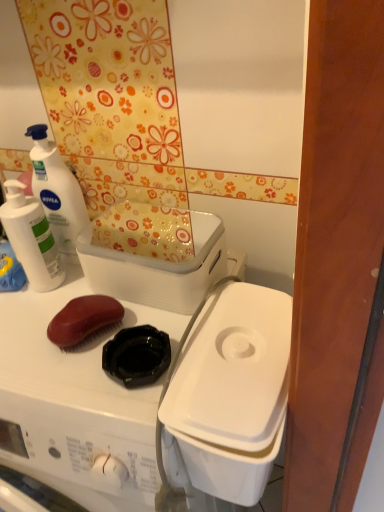
Question: From the image's perspective, would you say white plastic container at center-right, the 1th appliance when ordered from bottom to top, is shown under white matte lotion at upper left, which appears as the 1th cleaning product when viewed from the right?

Choices:
 (A) no
 (B) yes

Answer: (B)

Question: Is white plastic container at center-right, the 1th appliance when ordered from bottom to top, to the right of white matte lotion at upper left, which appears as the 1th cleaning product when viewed from the right, from the viewer's perspective?

Choices:
 (A) no
 (B) yes

Answer: (B)

Question: From a real-world perspective, is white plastic container at center-right, the 1th appliance when ordered from bottom to top, on white matte lotion at upper left, which appears as the 1th cleaning product when viewed from the right?

Choices:
 (A) no
 (B) yes

Answer: (A)

Question: Does white plastic container at center-right, the 1th appliance when ordered from bottom to top, appear on the left side of white matte lotion at upper left, the second cleaning product viewed from the left?

Choices:
 (A) no
 (B) yes

Answer: (A)

Question: Is white plastic container at center-right, the 1th appliance when ordered from bottom to top, positioned before white matte lotion at upper left, the second cleaning product viewed from the left?

Choices:
 (A) no
 (B) yes

Answer: (B)

Question: Looking at their shapes, would you say white plastic container at upper center, which is the 2th appliance in bottom-to-top order, is wider or thinner than white matte lotion at upper left, which appears as the 1th cleaning product when viewed from the right?

Choices:
 (A) thin
 (B) wide

Answer: (B)

Question: Based on their positions, is white plastic container at upper center, which is the 2th appliance in bottom-to-top order, located to the left or right of white matte lotion at upper left, which appears as the 1th cleaning product when viewed from the right?

Choices:
 (A) right
 (B) left

Answer: (A)

Question: In terms of height, does white plastic container at upper center, which is the 2th appliance in bottom-to-top order, look taller or shorter compared to white matte lotion at upper left, the second cleaning product viewed from the left?

Choices:
 (A) short
 (B) tall

Answer: (A)

Question: From the image's perspective, is white plastic container at upper center, which is the 2th appliance in bottom-to-top order, above or below white matte lotion at upper left, the second cleaning product viewed from the left?

Choices:
 (A) below
 (B) above

Answer: (A)

Question: Does point (109, 266) appear closer or farther from the camera than point (268, 430)?

Choices:
 (A) closer
 (B) farther

Answer: (B)

Question: Considering the positions of white plastic container at upper center, which is the 2th appliance in bottom-to-top order, and white plastic container at center-right, the 1th appliance when ordered from bottom to top, in the image, is white plastic container at upper center, which is the 2th appliance in bottom-to-top order, taller or shorter than white plastic container at center-right, the 1th appliance when ordered from bottom to top,?

Choices:
 (A) tall
 (B) short

Answer: (B)

Question: From the image's perspective, is white plastic container at upper center, which is the 2th appliance in bottom-to-top order, positioned above or below white plastic container at center-right, which is counted as the 2th appliance, starting from the top?

Choices:
 (A) above
 (B) below

Answer: (A)

Question: Would you say white plastic container at upper center, which is the 2th appliance in bottom-to-top order, is inside or outside white plastic container at center-right, which is counted as the 2th appliance, starting from the top?

Choices:
 (A) outside
 (B) inside

Answer: (A)

Question: From a real-world perspective, is white matte lotion at upper left, which appears as the 1th cleaning product when viewed from the right, physically located above or below white plastic washing machine at upper left?

Choices:
 (A) below
 (B) above

Answer: (B)

Question: Looking at the image, does white matte lotion at upper left, which appears as the 1th cleaning product when viewed from the right, seem bigger or smaller compared to white plastic washing machine at upper left?

Choices:
 (A) small
 (B) big

Answer: (A)